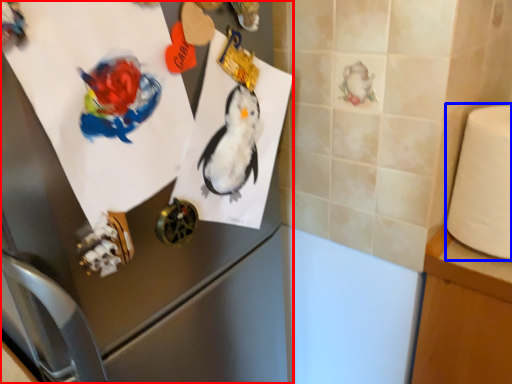
Question: Which of the following is the closest to the observer, appliance (highlighted by a red box) or toilet paper (highlighted by a blue box)?

Choices:
 (A) appliance
 (B) toilet paper

Answer: (A)